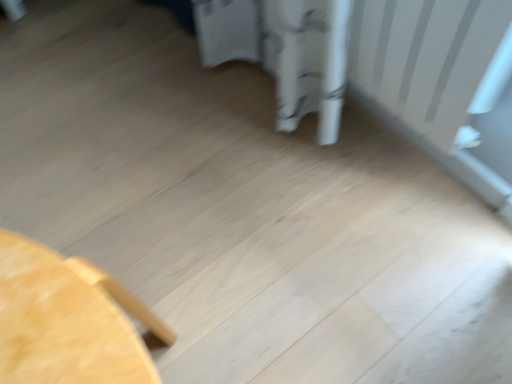
This screenshot has width=512, height=384. I want to click on light wood table at lower left, so click(67, 320).

The height and width of the screenshot is (384, 512). Describe the element at coordinates (67, 320) in the screenshot. I see `light wood table at lower left` at that location.

Locate an element on the screen. white matte radiator at upper right is located at coordinates (426, 59).

Image resolution: width=512 pixels, height=384 pixels. What do you see at coordinates (426, 59) in the screenshot?
I see `white matte radiator at upper right` at bounding box center [426, 59].

The width and height of the screenshot is (512, 384). Identify the location of light wood table at lower left. (67, 320).

Does light wood table at lower left appear on the right side of white matte radiator at upper right?

Incorrect, light wood table at lower left is not on the right side of white matte radiator at upper right.

Is light wood table at lower left positioned in front of white matte radiator at upper right?

Yes, light wood table at lower left is closer to the camera.

Considering the points (9, 273) and (429, 62), which point is in front, point (9, 273) or point (429, 62)?

Point (9, 273)

From the image's perspective, is light wood table at lower left beneath white matte radiator at upper right?

Indeed, from the image's perspective, light wood table at lower left is shown beneath white matte radiator at upper right.

From the picture: From a real-world perspective, which object stands above the other?

white matte radiator at upper right, from a real-world perspective.

Between light wood table at lower left and white matte radiator at upper right, which one has smaller width?

white matte radiator at upper right.

Who is shorter, light wood table at lower left or white matte radiator at upper right?

white matte radiator at upper right is shorter.

In terms of size, does light wood table at lower left appear bigger or smaller than white matte radiator at upper right?

Clearly, light wood table at lower left is larger in size than white matte radiator at upper right.

Based on the photo, is white matte radiator at upper right located within light wood table at lower left?

No, white matte radiator at upper right is not surrounded by light wood table at lower left.

Does light wood table at lower left touch white matte radiator at upper right?

No, light wood table at lower left is not making contact with white matte radiator at upper right.

Is white matte radiator at upper right at the back of light wood table at lower left?

No, white matte radiator at upper right is not at the back of light wood table at lower left.

What's the angular difference between light wood table at lower left and white matte radiator at upper right's facing directions?

light wood table at lower left and white matte radiator at upper right are facing 88 degrees away from each other.

Where is `radiator positioned vertically above the light wood table at lower left (from a real-world perspective)`? The width and height of the screenshot is (512, 384). radiator positioned vertically above the light wood table at lower left (from a real-world perspective) is located at coordinates (426, 59).

Between white matte radiator at upper right and light wood table at lower left, which one appears on the left side from the viewer's perspective?

light wood table at lower left.

Is white matte radiator at upper right in front of or behind light wood table at lower left in the image?

Clearly, white matte radiator at upper right is behind light wood table at lower left.

Based on the photo, which point is more distant from viewer, (507, 10) or (78, 352)?

Point (507, 10)

From the image's perspective, between white matte radiator at upper right and light wood table at lower left, which one is located above?

white matte radiator at upper right, from the image's perspective.

From a real-world perspective, is white matte radiator at upper right under light wood table at lower left?

Actually, white matte radiator at upper right is physically above light wood table at lower left in the real world.

Between white matte radiator at upper right and light wood table at lower left, which one has smaller width?

With smaller width is white matte radiator at upper right.

Considering the sizes of objects white matte radiator at upper right and light wood table at lower left in the image provided, who is taller, white matte radiator at upper right or light wood table at lower left?

light wood table at lower left is taller.

From the picture: Does white matte radiator at upper right have a smaller size compared to light wood table at lower left?

Indeed, white matte radiator at upper right has a smaller size compared to light wood table at lower left.

Is light wood table at lower left surrounded by white matte radiator at upper right?

No, light wood table at lower left is located outside of white matte radiator at upper right.

Consider the image. Are white matte radiator at upper right and light wood table at lower left located far from each other?

They are positioned close to each other.

Is white matte radiator at upper right aimed at light wood table at lower left?

Yes, white matte radiator at upper right is turned towards light wood table at lower left.

Can you tell me how much white matte radiator at upper right and light wood table at lower left differ in facing direction?

There is a 88-degree angle between the facing directions of white matte radiator at upper right and light wood table at lower left.

You are a GUI agent. You are given a task and a screenshot of the screen. Output one action in this format:
    pyautogui.click(x=<x>, y=<y>)
    Task: Click on the furniture on the left side of white matte radiator at upper right
    This screenshot has height=384, width=512.
    Given the screenshot: What is the action you would take?
    pyautogui.click(x=67, y=320)

You are a GUI agent. You are given a task and a screenshot of the screen. Output one action in this format:
    pyautogui.click(x=<x>, y=<y>)
    Task: Click on the radiator on the right of light wood table at lower left
    
    Given the screenshot: What is the action you would take?
    pyautogui.click(x=426, y=59)

The image size is (512, 384). In order to click on furniture lying on the left of white matte radiator at upper right in this screenshot , I will do point(67,320).